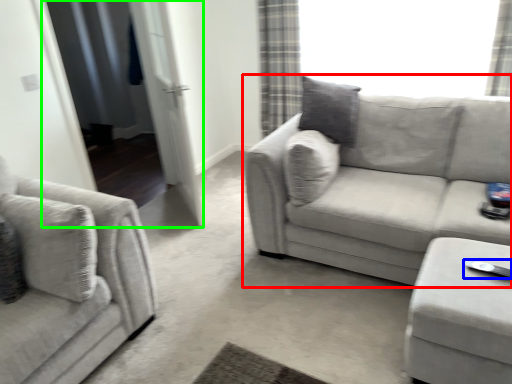
Question: Which is farther away from studio couch (highlighted by a red box)? Wii controller (highlighted by a blue box) or screen door (highlighted by a green box)?

Choices:
 (A) Wii controller
 (B) screen door

Answer: (B)